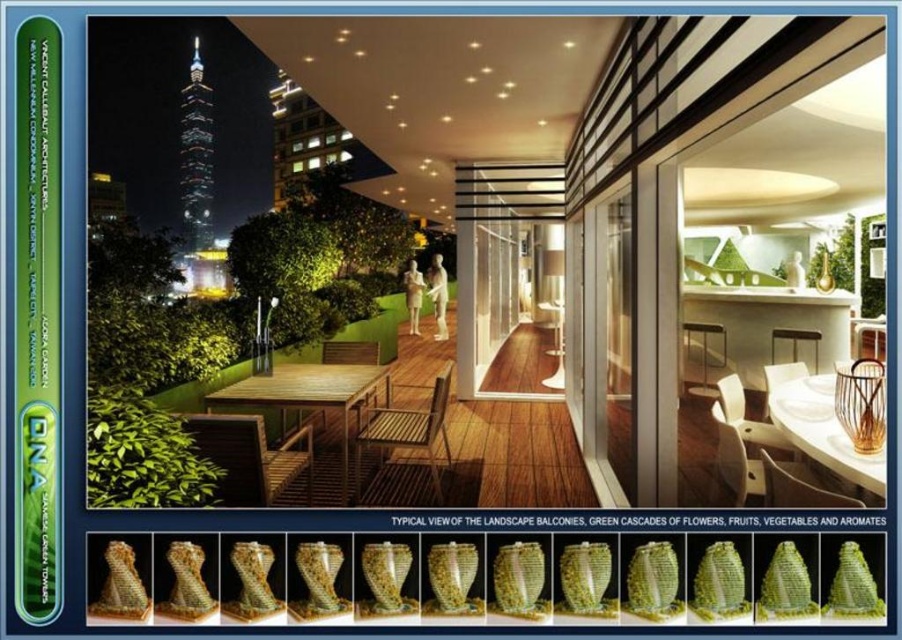
You are planning to host a small dinner party for four guests. The wooden table at left and wooden deck at center are available. Which one can accommodate more people comfortably?

The wooden table at left is larger in size than the wooden deck at center, so it can accommodate more people comfortably.

You are standing on the balcony and want to place a 4 feet long decorative sculpture on the wooden table at left. Is there enough space for it?

The wooden table at left is 4.23 feet from viewer, so the sculpture will fit as it is shorter than the table length.